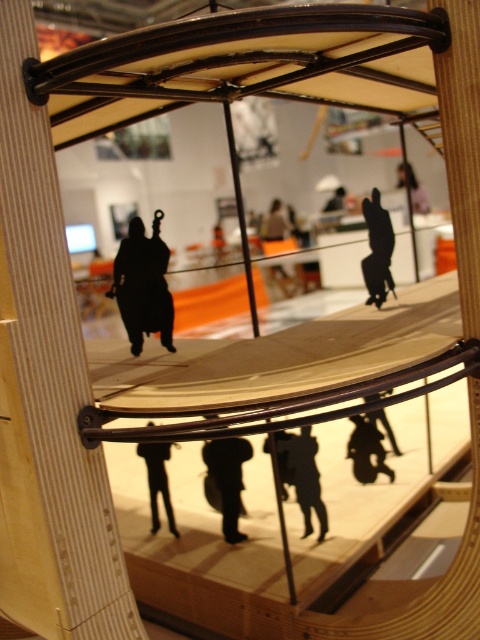
Who is positioned more to the right, dark matte figure at center or black matte pants at center?

Positioned to the right is dark matte figure at center.

Is dark matte figure at center in front of black matte pants at center?

No.

Between point (283, 268) and point (156, 490), which one is positioned in front?

Point (156, 490) is in front.

Find the location of `dark matte figure at center`. dark matte figure at center is located at coordinates (276, 230).

Which is more to the right, wooden figure at center or dark matte figure at center?

dark matte figure at center is more to the right.

Is point (232, 472) more distant than point (274, 218)?

That is False.

I want to click on wooden figure at center, so click(228, 480).

The height and width of the screenshot is (640, 480). I want to click on wooden figure at center, so click(x=228, y=480).

From the picture: Is dark matte figure at center to the right of black matte motorcycle at lower center from the viewer's perspective?

No, dark matte figure at center is not to the right of black matte motorcycle at lower center.

At what (x,y) coordinates should I click in order to perform the action: click on dark matte figure at center. Please return your answer as a coordinate pair (x, y). This screenshot has height=640, width=480. Looking at the image, I should click on (276, 230).

Between point (288, 264) and point (357, 433), which one is positioned behind?

The point (288, 264) is behind.

Identify the location of dark matte figure at center. (276, 230).